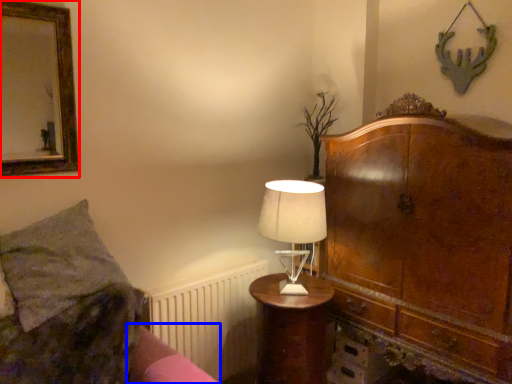
Question: Which object appears farthest to the camera in this image, picture frame (highlighted by a red box) or bed frame (highlighted by a blue box)?

Choices:
 (A) picture frame
 (B) bed frame

Answer: (A)